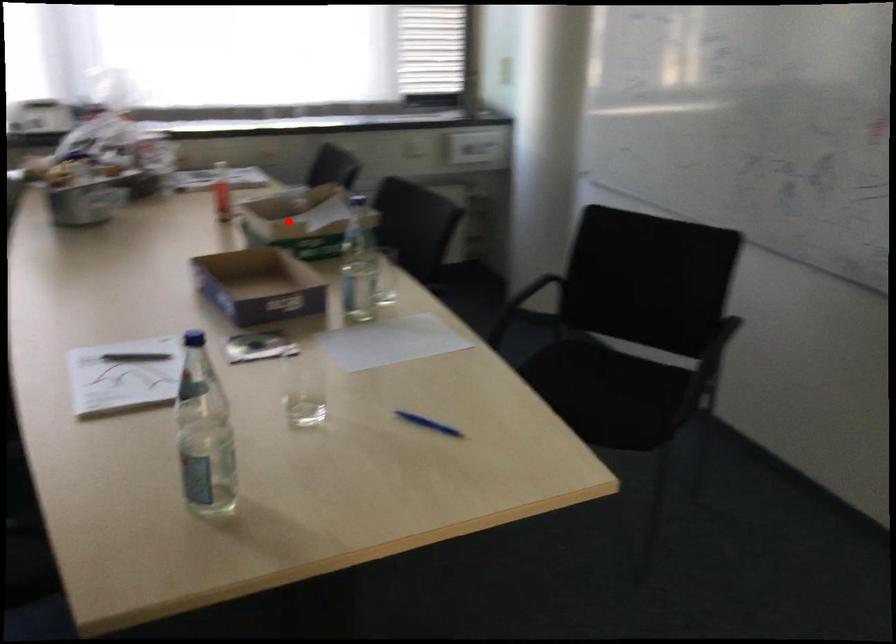
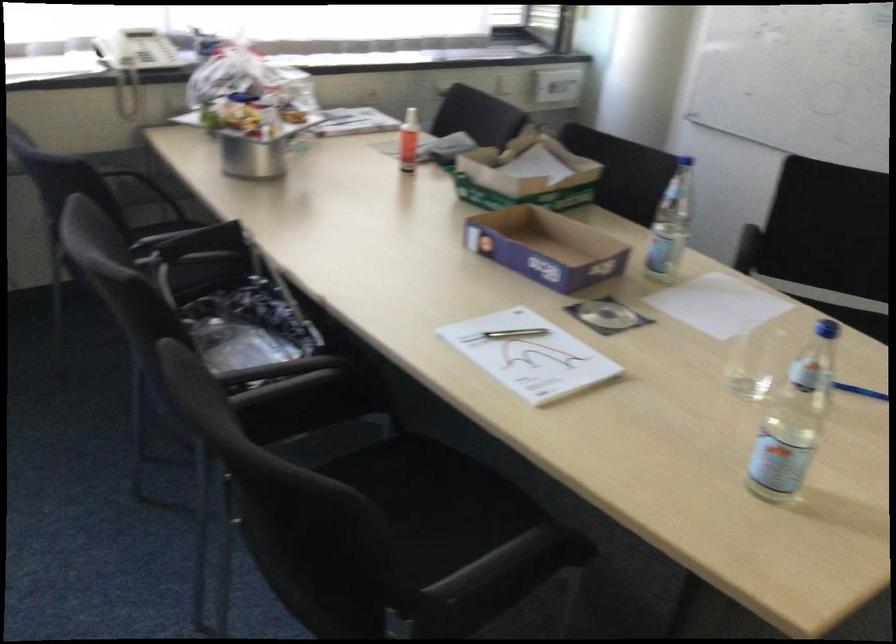
Where in the second image is the point corresponding to the highlighted location from the first image?

(526, 175)